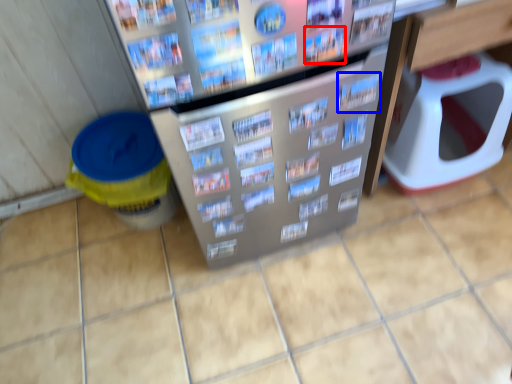
Question: Which of the following is the farthest to the observer, magazine (highlighted by a red box) or magazine (highlighted by a blue box)?

Choices:
 (A) magazine
 (B) magazine

Answer: (B)